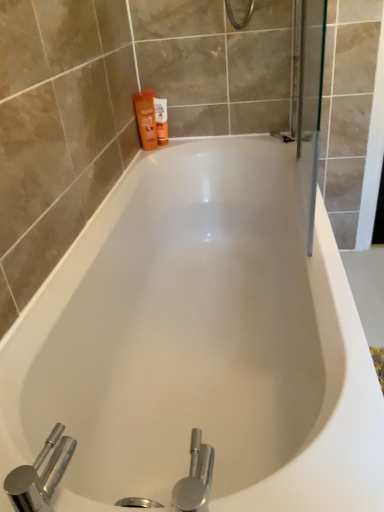
Question: Does orange matte bottle at upper left, which is the 2th toiletry in right-to-left order, have a greater height compared to orange matte lotion at upper left, which ranks as the second toiletry in left-to-right order?

Choices:
 (A) yes
 (B) no

Answer: (A)

Question: Is orange matte bottle at upper left, which is the 2th toiletry in right-to-left order, shorter than orange matte lotion at upper left, which is the first toiletry from right to left?

Choices:
 (A) yes
 (B) no

Answer: (B)

Question: Is orange matte bottle at upper left, which is the 2th toiletry in right-to-left order, closer to the viewer compared to orange matte lotion at upper left, which is the first toiletry from right to left?

Choices:
 (A) yes
 (B) no

Answer: (A)

Question: Is orange matte bottle at upper left, which is the 2th toiletry in right-to-left order, smaller than orange matte lotion at upper left, which ranks as the second toiletry in left-to-right order?

Choices:
 (A) yes
 (B) no

Answer: (B)

Question: From a real-world perspective, is orange matte bottle at upper left, placed as the 1th toiletry when sorted from left to right, positioned under orange matte lotion at upper left, which ranks as the second toiletry in left-to-right order, based on gravity?

Choices:
 (A) no
 (B) yes

Answer: (A)

Question: Considering the relative positions of orange matte lotion at upper left, which is the first toiletry from right to left, and orange matte bottle at upper left, which is the 2th toiletry in right-to-left order, in the image provided, is orange matte lotion at upper left, which is the first toiletry from right to left, to the left or to the right of orange matte bottle at upper left, which is the 2th toiletry in right-to-left order,?

Choices:
 (A) right
 (B) left

Answer: (A)

Question: Do you think orange matte lotion at upper left, which is the first toiletry from right to left, is within orange matte bottle at upper left, placed as the 1th toiletry when sorted from left to right, or outside of it?

Choices:
 (A) inside
 (B) outside

Answer: (A)

Question: In terms of width, does orange matte lotion at upper left, which is the first toiletry from right to left, look wider or thinner when compared to orange matte bottle at upper left, which is the 2th toiletry in right-to-left order?

Choices:
 (A) wide
 (B) thin

Answer: (B)

Question: Is point (157, 103) closer or farther from the camera than point (152, 136)?

Choices:
 (A) farther
 (B) closer

Answer: (B)

Question: Considering the positions of orange matte bottle at upper left, placed as the 1th toiletry when sorted from left to right, and chrome metallic faucet at lower left in the image, is orange matte bottle at upper left, placed as the 1th toiletry when sorted from left to right, bigger or smaller than chrome metallic faucet at lower left?

Choices:
 (A) big
 (B) small

Answer: (A)

Question: Relative to chrome metallic faucet at lower left, is orange matte bottle at upper left, placed as the 1th toiletry when sorted from left to right, in front or behind?

Choices:
 (A) front
 (B) behind

Answer: (B)

Question: From their relative heights in the image, would you say orange matte bottle at upper left, which is the 2th toiletry in right-to-left order, is taller or shorter than chrome metallic faucet at lower left?

Choices:
 (A) short
 (B) tall

Answer: (B)

Question: Considering the positions of orange matte bottle at upper left, placed as the 1th toiletry when sorted from left to right, and chrome metallic faucet at lower left in the image, is orange matte bottle at upper left, placed as the 1th toiletry when sorted from left to right, wider or thinner than chrome metallic faucet at lower left?

Choices:
 (A) wide
 (B) thin

Answer: (B)

Question: Based on their positions, is white glossy bathtub at center located to the left or right of chrome metallic faucet at lower left?

Choices:
 (A) right
 (B) left

Answer: (A)

Question: From the image's perspective, relative to chrome metallic faucet at lower left, is white glossy bathtub at center above or below?

Choices:
 (A) above
 (B) below

Answer: (A)